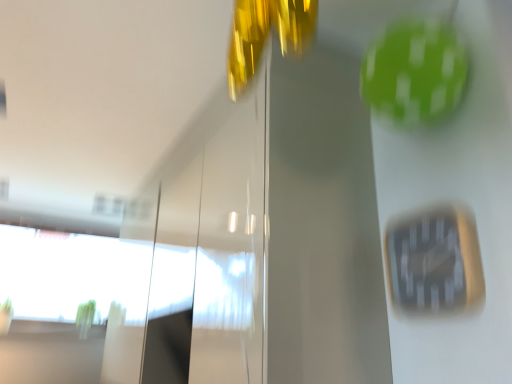
Question: Is black plastic clock at center-right in front of or behind transparent glass window at lower left in the image?

Choices:
 (A) front
 (B) behind

Answer: (A)

Question: Is black plastic clock at center-right taller or shorter than transparent glass window at lower left?

Choices:
 (A) short
 (B) tall

Answer: (A)

Question: Considering the positions of black plastic clock at center-right and transparent glass window at lower left in the image, is black plastic clock at center-right wider or thinner than transparent glass window at lower left?

Choices:
 (A) thin
 (B) wide

Answer: (A)

Question: From the image's perspective, relative to black plastic clock at center-right, is transparent glass window at lower left above or below?

Choices:
 (A) above
 (B) below

Answer: (B)

Question: Is transparent glass window at lower left inside or outside of black plastic clock at center-right?

Choices:
 (A) outside
 (B) inside

Answer: (A)

Question: Looking at the image, does transparent glass window at lower left seem bigger or smaller compared to black plastic clock at center-right?

Choices:
 (A) big
 (B) small

Answer: (A)

Question: Considering the positions of transparent glass window at lower left and black plastic clock at center-right in the image, is transparent glass window at lower left taller or shorter than black plastic clock at center-right?

Choices:
 (A) tall
 (B) short

Answer: (A)